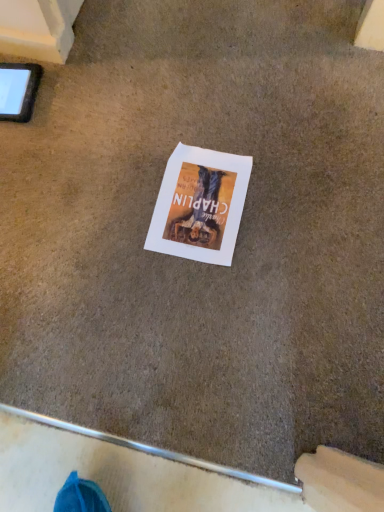
Locate an element on the screen. The height and width of the screenshot is (512, 384). free location to the right of white paper at center is located at coordinates (289, 206).